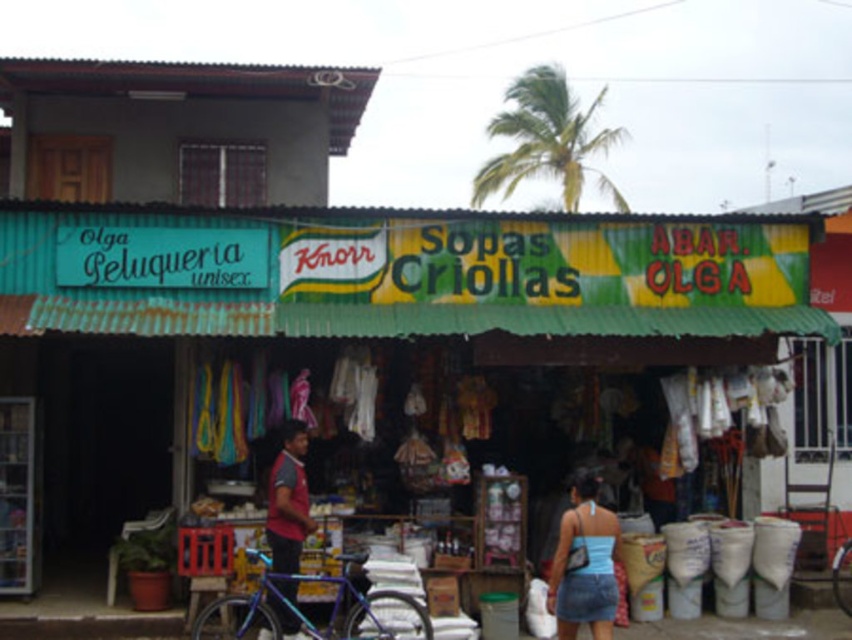
Question: Is shiny blue frame bicycle at center to the right of blue metallic bicycle at center from the viewer's perspective?

Choices:
 (A) yes
 (B) no

Answer: (B)

Question: Which object is closer to the camera taking this photo?

Choices:
 (A) teal painted wood peluqueria sign at upper left
 (B) shiny blue frame bicycle at center
 (C) blue metallic bicycle at center
 (D) blue denim skirt at lower right

Answer: (D)

Question: Does blue denim skirt at lower right lie behind blue metallic bicycle at center?

Choices:
 (A) no
 (B) yes

Answer: (A)

Question: Which of these objects is positioned closest to the teal painted wood peluqueria sign at upper left?

Choices:
 (A) blue denim skirt at lower right
 (B) blue metallic bicycle at center
 (C) red fabric shirt at center

Answer: (C)

Question: Among these points, which one is nearest to the camera?

Choices:
 (A) (243, 612)
 (B) (842, 552)
 (C) (281, 625)
 (D) (13, 470)

Answer: (C)

Question: Does blue denim skirt at lower right have a larger size compared to blue metallic bicycle at center?

Choices:
 (A) no
 (B) yes

Answer: (B)